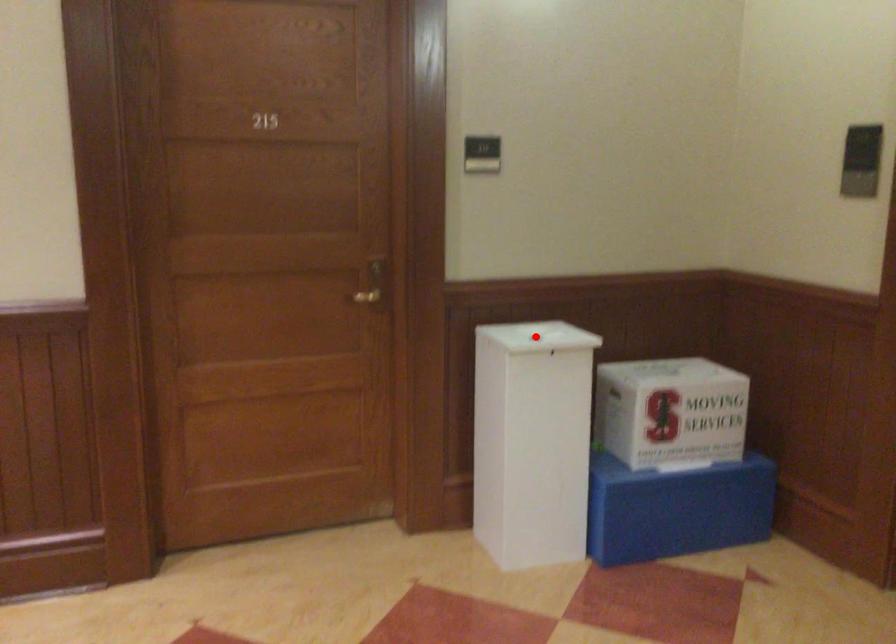
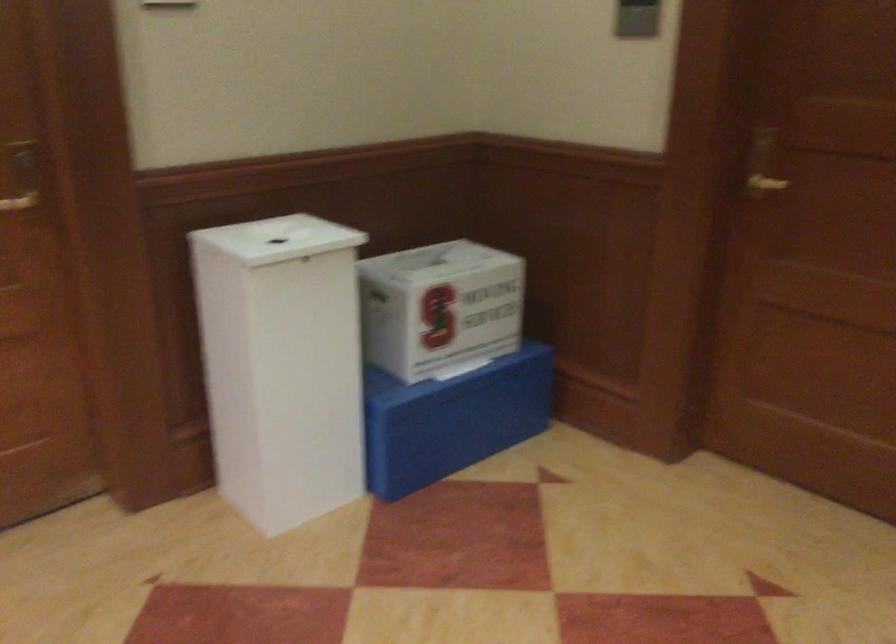
The point at the highlighted location is marked in the first image. Where is the corresponding point in the second image?

(277, 238)